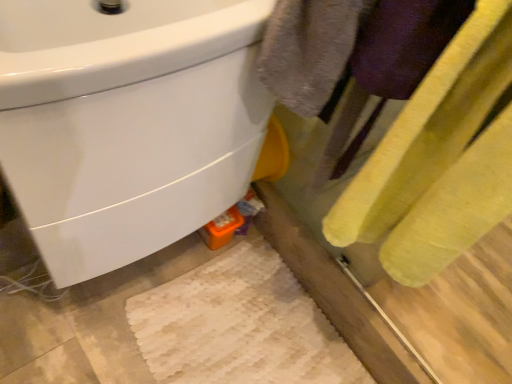
Describe the element at coordinates (127, 123) in the screenshot. The height and width of the screenshot is (384, 512). I see `white glossy sink at upper left` at that location.

Identify the location of white glossy sink at upper left. (127, 123).

In order to face white glossy sink at upper left, should I rotate leftwards or rightwards?

To align with it, rotate left about 15.413°.

I want to click on yellow fabric towel at right, so [432, 155].

The image size is (512, 384). What do you see at coordinates (432, 155) in the screenshot?
I see `yellow fabric towel at right` at bounding box center [432, 155].

Where is `white glossy sink at upper left`? white glossy sink at upper left is located at coordinates (127, 123).

Considering the relative positions of white glossy sink at upper left and yellow fabric towel at right in the image provided, is white glossy sink at upper left to the left of yellow fabric towel at right from the viewer's perspective?

Correct, you'll find white glossy sink at upper left to the left of yellow fabric towel at right.

Is white glossy sink at upper left behind yellow fabric towel at right?

Yes, the depth of white glossy sink at upper left is greater than that of yellow fabric towel at right.

Considering the points (143, 187) and (433, 176), which point is in front, point (143, 187) or point (433, 176)?

The point (433, 176) is closer to the camera.

From the image's perspective, is white glossy sink at upper left under yellow fabric towel at right?

No, from the image's perspective, white glossy sink at upper left is not beneath yellow fabric towel at right.

From the picture: From a real-world perspective, is white glossy sink at upper left physically above yellow fabric towel at right?

No, from a real-world perspective, white glossy sink at upper left is not on top of yellow fabric towel at right.

Which object is wider, white glossy sink at upper left or yellow fabric towel at right?

white glossy sink at upper left is wider.

Who is taller, white glossy sink at upper left or yellow fabric towel at right?

With more height is yellow fabric towel at right.

Can you confirm if white glossy sink at upper left is smaller than yellow fabric towel at right?

No, white glossy sink at upper left is not smaller than yellow fabric towel at right.

Is white glossy sink at upper left not within yellow fabric towel at right?

Absolutely, white glossy sink at upper left is external to yellow fabric towel at right.

Is white glossy sink at upper left not close to yellow fabric towel at right?

No, there isn't a large distance between white glossy sink at upper left and yellow fabric towel at right.

Is white glossy sink at upper left positioned with its back to yellow fabric towel at right?

That's not correct — white glossy sink at upper left is not looking away from yellow fabric towel at right.

How different are the orientations of white glossy sink at upper left and yellow fabric towel at right in degrees?

There is a 90.8-degree angle between the facing directions of white glossy sink at upper left and yellow fabric towel at right.

Identify the location of bath towel below the white glossy sink at upper left (from the image's perspective). (432, 155).

In the scene shown: Which object is positioned more to the left, yellow fabric towel at right or white glossy sink at upper left?

Positioned to the left is white glossy sink at upper left.

Is the position of yellow fabric towel at right more distant than that of white glossy sink at upper left?

No, it is in front of white glossy sink at upper left.

Consider the image. Which is farther, [460,202] or [48,78]?

Point [460,202]

From the image's perspective, is yellow fabric towel at right above white glossy sink at upper left?

Incorrect, from the image's perspective, yellow fabric towel at right is lower than white glossy sink at upper left.

From a real-world perspective, which object stands above the other?

In real-world perspective, yellow fabric towel at right is above.

From the picture: Can you confirm if yellow fabric towel at right is thinner than white glossy sink at upper left?

Yes, yellow fabric towel at right is thinner than white glossy sink at upper left.

Which of these two, yellow fabric towel at right or white glossy sink at upper left, stands shorter?

Standing shorter between the two is white glossy sink at upper left.

Is yellow fabric towel at right bigger than white glossy sink at upper left?

Actually, yellow fabric towel at right might be smaller than white glossy sink at upper left.

Would you say white glossy sink at upper left is part of yellow fabric towel at right's contents?

Definitely not — white glossy sink at upper left is not inside yellow fabric towel at right.

Would you say yellow fabric towel at right is a long distance from white glossy sink at upper left?

yellow fabric towel at right is near white glossy sink at upper left, not far away.

Does yellow fabric towel at right turn towards white glossy sink at upper left?

Yes, yellow fabric towel at right is turned towards white glossy sink at upper left.

I want to click on bath towel located on the right of white glossy sink at upper left, so click(432, 155).

I want to click on sink on the left side of yellow fabric towel at right, so click(127, 123).

Identify the location of bath towel that is above the white glossy sink at upper left (from a real-world perspective). (432, 155).